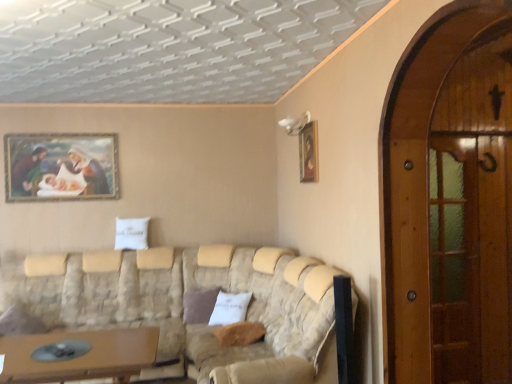
Question: Is wooden screen door at right, which appears as the 2th screen door when viewed from the back, smaller than brown fabric pillow at center, the first pillow positioned from the back?

Choices:
 (A) no
 (B) yes

Answer: (A)

Question: From the image's perspective, is wooden screen door at right, the 2th screen door when ordered from right to left, on top of brown fabric pillow at center, marked as the 2th pillow in a right-to-left arrangement?

Choices:
 (A) yes
 (B) no

Answer: (A)

Question: Is wooden screen door at right, the 2th screen door when ordered from right to left, facing towards brown fabric pillow at center, which appears as the second pillow when viewed from the front?

Choices:
 (A) yes
 (B) no

Answer: (B)

Question: Would you say wooden screen door at right, the 2th screen door when ordered from right to left, contains brown fabric pillow at center, the first pillow positioned from the back?

Choices:
 (A) yes
 (B) no

Answer: (B)

Question: Does wooden screen door at right, the 2th screen door when ordered from right to left, have a lesser width compared to brown fabric pillow at center, which appears as the second pillow when viewed from the front?

Choices:
 (A) yes
 (B) no

Answer: (A)

Question: From a real-world perspective, relative to wooden screen door at right, the second screen door in the left-to-right sequence, is wooden framed painting at upper left, the second picture frame positioned from the front, vertically above or below?

Choices:
 (A) above
 (B) below

Answer: (A)

Question: In the image, is wooden framed painting at upper left, the second picture frame positioned from the front, on the left side or the right side of wooden screen door at right, the second screen door in the left-to-right sequence?

Choices:
 (A) right
 (B) left

Answer: (B)

Question: From the image's perspective, is wooden framed painting at upper left, the second picture frame positioned from the front, located above or below wooden screen door at right, the second screen door when ordered from front to back?

Choices:
 (A) below
 (B) above

Answer: (B)

Question: Considering the positions of wooden framed painting at upper left, the second picture frame positioned from the front, and wooden screen door at right, the second screen door in the left-to-right sequence, in the image, is wooden framed painting at upper left, the second picture frame positioned from the front, taller or shorter than wooden screen door at right, the second screen door in the left-to-right sequence,?

Choices:
 (A) tall
 (B) short

Answer: (B)

Question: Considering the relative positions of beige fabric couch at lower center and wooden framed painting at upper left, marked as the 2th picture frame in a right-to-left arrangement, in the image provided, is beige fabric couch at lower center to the left or to the right of wooden framed painting at upper left, marked as the 2th picture frame in a right-to-left arrangement,?

Choices:
 (A) left
 (B) right

Answer: (B)

Question: In terms of height, does beige fabric couch at lower center look taller or shorter compared to wooden framed painting at upper left, the second picture frame positioned from the front?

Choices:
 (A) short
 (B) tall

Answer: (B)

Question: From the image's perspective, is beige fabric couch at lower center positioned above or below wooden framed painting at upper left, arranged as the first picture frame when viewed from the back?

Choices:
 (A) below
 (B) above

Answer: (A)

Question: Looking at the image, does beige fabric couch at lower center seem bigger or smaller compared to wooden framed painting at upper left, the second picture frame positioned from the front?

Choices:
 (A) small
 (B) big

Answer: (B)

Question: Considering the positions of wooden framed painting at upper left, the second picture frame positioned from the front, and brown fabric pillow at center, the first pillow positioned from the back, in the image, is wooden framed painting at upper left, the second picture frame positioned from the front, taller or shorter than brown fabric pillow at center, the first pillow positioned from the back,?

Choices:
 (A) short
 (B) tall

Answer: (B)

Question: From a real-world perspective, is wooden framed painting at upper left, the second picture frame positioned from the front, above or below brown fabric pillow at center, the first pillow positioned from the back?

Choices:
 (A) above
 (B) below

Answer: (A)